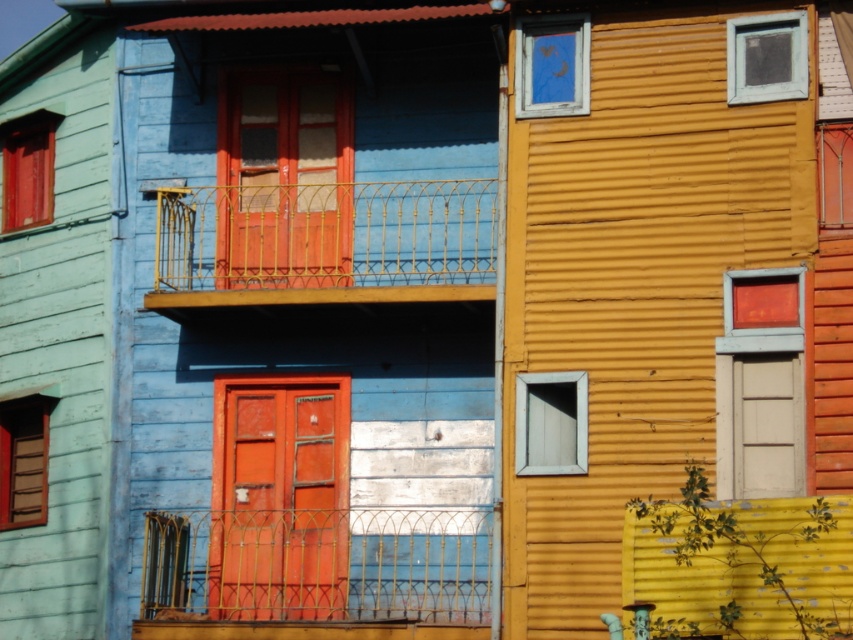
Is gold wrought iron balcony at center smaller than white matte door at center?

Actually, gold wrought iron balcony at center might be larger than white matte door at center.

Is gold wrought iron balcony at center to the right of white matte door at center from the viewer's perspective?

In fact, gold wrought iron balcony at center is to the left of white matte door at center.

Describe the element at coordinates (325, 243) in the screenshot. The height and width of the screenshot is (640, 853). I see `gold wrought iron balcony at center` at that location.

You are a GUI agent. You are given a task and a screenshot of the screen. Output one action in this format:
    pyautogui.click(x=<x>, y=<y>)
    Task: Click on the gold wrought iron balcony at center
    The width and height of the screenshot is (853, 640).
    Given the screenshot: What is the action you would take?
    click(x=325, y=243)

Between point (323, 536) and point (733, 465), which one is positioned behind?

The point (323, 536) is behind.

Does smooth wooden door at center appear under white matte door at center?

Yes.

Who is more distant from viewer, (300,566) or (735,492)?

Point (300,566)

What are the coordinates of `smooth wooden door at center` in the screenshot? It's located at (279, 499).

Can you confirm if gold wrought iron balcony at center is positioned below smooth wooden door at center?

Actually, gold wrought iron balcony at center is above smooth wooden door at center.

Is gold wrought iron balcony at center bigger than smooth wooden door at center?

Correct, gold wrought iron balcony at center is larger in size than smooth wooden door at center.

Where is `gold wrought iron balcony at center`? This screenshot has height=640, width=853. gold wrought iron balcony at center is located at coordinates (325, 243).